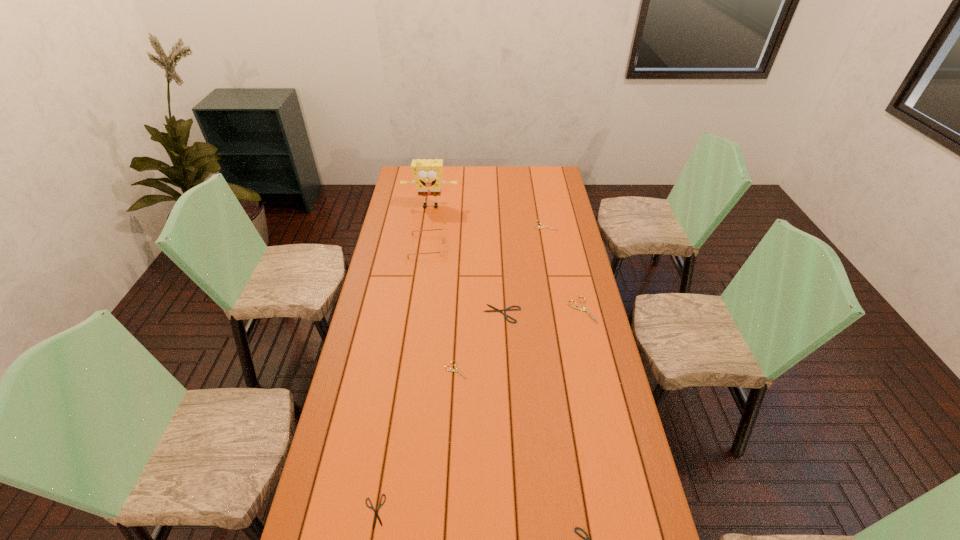
Image resolution: width=960 pixels, height=540 pixels. Identify the location of sponge. (427, 174).

You are a GUI agent. You are given a task and a screenshot of the screen. Output one action in this format:
    pyautogui.click(x=<x>, y=<y>)
    Task: Click on the farthest object
    Image resolution: width=960 pixels, height=540 pixels.
    Given the screenshot: What is the action you would take?
    pyautogui.click(x=427, y=174)

At what (x,y) coordinates should I click in order to perform the action: click on spectacles. Please return your answer as a coordinate pair (x, y). The height and width of the screenshot is (540, 960). Looking at the image, I should click on [x=441, y=251].

Where is `the third farthest object`? The width and height of the screenshot is (960, 540). the third farthest object is located at coordinates (441, 251).

Identify the location of the biggest beige shears. The image size is (960, 540). (584, 308).

The height and width of the screenshot is (540, 960). In order to click on the sixth shortest object in this screenshot , I will do `click(584, 308)`.

This screenshot has height=540, width=960. Identify the location of the farthest beige shears. (539, 227).

Identify the location of the second biggest beige shears. (539, 227).

You are a GUI agent. You are given a task and a screenshot of the screen. Output one action in this format:
    pyautogui.click(x=<x>, y=<y>)
    Task: Click on the farthest black shears
    The width and height of the screenshot is (960, 540).
    Given the screenshot: What is the action you would take?
    pyautogui.click(x=507, y=309)

The width and height of the screenshot is (960, 540). I want to click on the second black shears from left to right, so click(x=507, y=309).